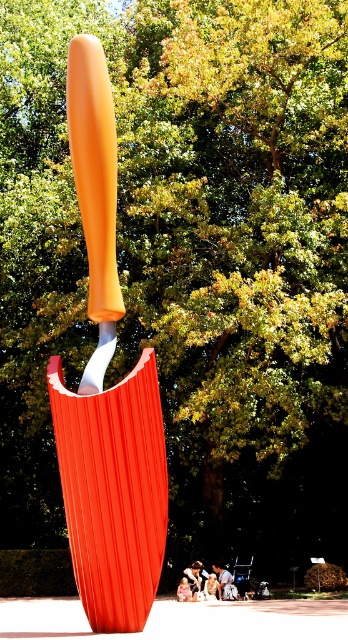
You are standing 30 feet away from the orange matte shovel at center. Can you safely walk forward to reach it without overextending?

The orange matte shovel at center is 32.88 feet away from the camera. Since you are already 30 feet away, you need to walk an additional 2.88 feet to reach it, which is a safe distance without overextending.

Consider the image. You are standing in front of the sculpture and want to place a small flower pot between the orange matte shovel at center and the white fabric person at center. Based on their positions, where should you place the flower pot?

The orange matte shovel at center is above the white fabric person at center, so you should place the flower pot between them either below the shovel and above the person or in the space where they overlap vertically.

Looking at this image, you are an artist observing the sculpture and the shirt in the image. Which object is closer to you, the orange matte knife at center or the smooth white shirt at center?

The orange matte knife at center is closer to you because it is in front of the smooth white shirt at center.